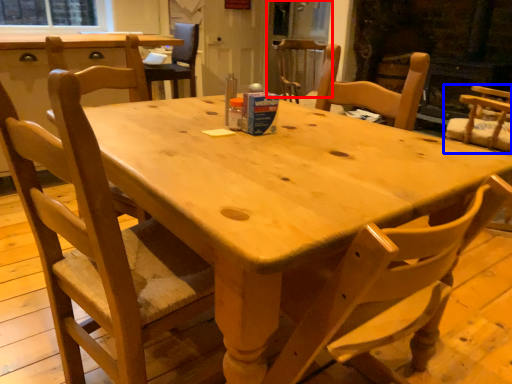
Question: Which point is closer to the camera, screen door (highlighted by a red box) or chair (highlighted by a blue box)?

Choices:
 (A) screen door
 (B) chair

Answer: (B)